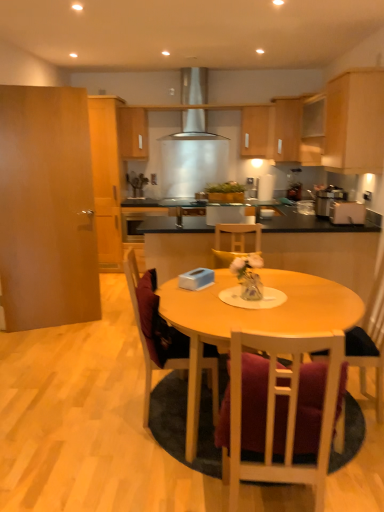
This screenshot has height=512, width=384. Identify the location of wooden cabinet at upper right, the 8th cabinetry in the left-to-right sequence. (312, 131).

How much space does wooden cabinet at upper right, placed as the 6th cabinetry when sorted from left to right, occupy vertically?

81.36 centimeters.

This screenshot has width=384, height=512. Describe the element at coordinates (326, 199) in the screenshot. I see `white glossy microwave at upper right, which is counted as the 2th appliance, starting from the front` at that location.

This screenshot has height=512, width=384. Find the location of `wooden chair at center, which is the 1th chair in left-to-right order`. wooden chair at center, which is the 1th chair in left-to-right order is located at coordinates (139, 326).

From a real-world perspective, is wooden chair at center, the 3th chair from the right, under wooden cabinet at upper center, the sixth cabinetry from the right?

Yes, from a real-world perspective, wooden chair at center, the 3th chair from the right, is below wooden cabinet at upper center, the sixth cabinetry from the right.

Considering the sizes of wooden chair at center, which is the 1th chair in left-to-right order, and wooden cabinet at upper center, the sixth cabinetry from the right, in the image, is wooden chair at center, which is the 1th chair in left-to-right order, bigger or smaller than wooden cabinet at upper center, the sixth cabinetry from the right,?

In the image, wooden chair at center, which is the 1th chair in left-to-right order, appears to be larger than wooden cabinet at upper center, the sixth cabinetry from the right.

Can you confirm if wooden chair at center, the 3th chair from the right, is taller than wooden cabinet at upper center, which ranks as the 3th cabinetry in left-to-right order?

Yes, wooden chair at center, the 3th chair from the right, is taller than wooden cabinet at upper center, which ranks as the 3th cabinetry in left-to-right order.

Is wooden chair at center, which is the 1th chair in left-to-right order, spatially inside wooden cabinet at upper center, which ranks as the 3th cabinetry in left-to-right order, or outside of it?

wooden chair at center, which is the 1th chair in left-to-right order, is not enclosed by wooden cabinet at upper center, which ranks as the 3th cabinetry in left-to-right order.

Is satin silver toaster at upper right, the second appliance viewed from the back, oriented towards wooden cabinet at upper right, placed as the 6th cabinetry when sorted from left to right?

No, satin silver toaster at upper right, the second appliance viewed from the back, is not oriented towards wooden cabinet at upper right, placed as the 6th cabinetry when sorted from left to right.

Is satin silver toaster at upper right, the first appliance when ordered from front to back, thinner than wooden cabinet at upper right, placed as the 6th cabinetry when sorted from left to right?

Yes.

Which object is positioned more to the left, satin silver toaster at upper right, the second appliance viewed from the back, or wooden cabinet at upper right, placed as the 6th cabinetry when sorted from left to right?

wooden cabinet at upper right, placed as the 6th cabinetry when sorted from left to right, is more to the left.

Who is smaller, satin silver toaster at upper right, the second appliance viewed from the back, or wooden cabinet at upper right, placed as the 6th cabinetry when sorted from left to right?

satin silver toaster at upper right, the second appliance viewed from the back.

Would you say white wooden chair at center, marked as the second chair in a left-to-right arrangement, is to the left or to the right of stainless steel exhaust hood at center in the picture?

Based on their positions, white wooden chair at center, marked as the second chair in a left-to-right arrangement, is located to the right of stainless steel exhaust hood at center.

Considering the points (271, 380) and (186, 117), which point is behind, point (271, 380) or point (186, 117)?

Positioned behind is point (186, 117).

Which of these two, white wooden chair at center, marked as the second chair in a right-to-left arrangement, or stainless steel exhaust hood at center, is wider?

Wider between the two is white wooden chair at center, marked as the second chair in a right-to-left arrangement.

Looking at this image, is white wooden chair at center, marked as the second chair in a right-to-left arrangement, completely or partially outside of stainless steel exhaust hood at center?

That's correct, white wooden chair at center, marked as the second chair in a right-to-left arrangement, is outside of stainless steel exhaust hood at center.

From the picture: Could you tell me if white glossy microwave at upper right, which is counted as the 2th appliance, starting from the front, is facing matte silver sink at center?

Yes, white glossy microwave at upper right, which is counted as the 2th appliance, starting from the front, is oriented towards matte silver sink at center.

Between white glossy microwave at upper right, which is counted as the 2th appliance, starting from the front, and matte silver sink at center, which one has larger width?

white glossy microwave at upper right, which is counted as the 2th appliance, starting from the front, is wider.

Is white glossy microwave at upper right, the 1th appliance positioned from the back, bigger or smaller than matte silver sink at center?

Clearly, white glossy microwave at upper right, the 1th appliance positioned from the back, is smaller in size than matte silver sink at center.

From a real-world perspective, is white glossy microwave at upper right, which is counted as the 2th appliance, starting from the front, over matte silver sink at center?

No, from a real-world perspective, white glossy microwave at upper right, which is counted as the 2th appliance, starting from the front, is not on top of matte silver sink at center.

Looking at this image, is wooden chair at right, the 3th chair viewed from the left, shorter than light wood cabinet at upper right, the seventh cabinetry positioned from the left?

No, wooden chair at right, the 3th chair viewed from the left, is not shorter than light wood cabinet at upper right, the seventh cabinetry positioned from the left.

Is point (355, 354) farther from camera compared to point (324, 165)?

That is False.

Is wooden chair at right, arranged as the first chair when viewed from the right, far from light wood cabinet at upper right, the seventh cabinetry positioned from the left?

Indeed, wooden chair at right, arranged as the first chair when viewed from the right, is not near light wood cabinet at upper right, the seventh cabinetry positioned from the left.

Considering the positions of objects wooden chair at right, the 3th chair viewed from the left, and light wood cabinet at upper right, positioned as the 2th cabinetry in right-to-left order, in the image provided, who is more to the right, wooden chair at right, the 3th chair viewed from the left, or light wood cabinet at upper right, positioned as the 2th cabinetry in right-to-left order,?

light wood cabinet at upper right, positioned as the 2th cabinetry in right-to-left order.

Do you think brown wood door at left, placed as the 8th cabinetry when sorted from right to left, is within matte silver sink at center, or outside of it?

brown wood door at left, placed as the 8th cabinetry when sorted from right to left, cannot be found inside matte silver sink at center.

Looking at this image, can you confirm if brown wood door at left, placed as the 8th cabinetry when sorted from right to left, is bigger than matte silver sink at center?

Yes, brown wood door at left, placed as the 8th cabinetry when sorted from right to left, is bigger than matte silver sink at center.

Is brown wood door at left, which is counted as the 1th cabinetry, starting from the left, in front of or behind matte silver sink at center in the image?

Visually, brown wood door at left, which is counted as the 1th cabinetry, starting from the left, is located in front of matte silver sink at center.

Can you confirm if brown wood door at left, which is counted as the 1th cabinetry, starting from the left, is shorter than matte silver sink at center?

No, brown wood door at left, which is counted as the 1th cabinetry, starting from the left, is not shorter than matte silver sink at center.

Considering the relative sizes of light wood cabinet at upper right, the seventh cabinetry positioned from the left, and wooden cabinet at upper right, placed as the 6th cabinetry when sorted from left to right, in the image provided, is light wood cabinet at upper right, the seventh cabinetry positioned from the left, bigger than wooden cabinet at upper right, placed as the 6th cabinetry when sorted from left to right,?

No.

Locate an element on the screen. Image resolution: width=384 pixels, height=512 pixels. cabinetry that is the 2nd object located below the wooden cabinet at upper right, which appears as the 3th cabinetry when viewed from the right (from the image's perspective) is located at coordinates (354, 122).

Is light wood cabinet at upper right, the seventh cabinetry positioned from the left, situated inside wooden cabinet at upper right, placed as the 6th cabinetry when sorted from left to right, or outside?

The correct answer is: outside.

Could you tell me if light wood cabinet at upper right, positioned as the 2th cabinetry in right-to-left order, is facing wooden cabinet at upper right, which appears as the 3th cabinetry when viewed from the right?

No, light wood cabinet at upper right, positioned as the 2th cabinetry in right-to-left order, is not oriented towards wooden cabinet at upper right, which appears as the 3th cabinetry when viewed from the right.

From a real-world perspective, which cabinetry is the 7th one above the wooden chair at center, the 3th chair from the right? Please provide its 2D coordinates.

[(133, 133)]

Find the location of `appliance lying on the right of wooden cabinet at upper right, which appears as the 3th cabinetry when viewed from the right`. appliance lying on the right of wooden cabinet at upper right, which appears as the 3th cabinetry when viewed from the right is located at coordinates (347, 213).

Considering their positions, is wooden chair at center, which is the 1th chair in left-to-right order, positioned closer to white glossy microwave at upper right, the 1th appliance positioned from the back, than wooden cabinet at upper right, positioned as the first cabinetry in right-to-left order?

wooden cabinet at upper right, positioned as the first cabinetry in right-to-left order, is closer to white glossy microwave at upper right, the 1th appliance positioned from the back.

Which object lies nearer to the anchor point wooden chair at right, arranged as the first chair when viewed from the right, wooden cabinet at upper right, the 8th cabinetry in the left-to-right sequence, or matte wood cabinet at upper center, placed as the fifth cabinetry when sorted from left to right?

Among the two, wooden cabinet at upper right, the 8th cabinetry in the left-to-right sequence, is located nearer to wooden chair at right, arranged as the first chair when viewed from the right.

Which object lies further to the anchor point matte silver sink at center, wooden chair at center, the 3th chair from the right, or wooden cabinet at upper center, which ranks as the 3th cabinetry in left-to-right order?

Based on the image, wooden chair at center, the 3th chair from the right, appears to be further to matte silver sink at center.

Looking at this image, from the image, which object appears to be nearer to wooden cabinet at upper center, which ranks as the 3th cabinetry in left-to-right order, wooden cabinet at upper right, the 8th cabinetry in the left-to-right sequence, or white glossy microwave at upper right, which is counted as the 2th appliance, starting from the front?

The object closer to wooden cabinet at upper center, which ranks as the 3th cabinetry in left-to-right order, is wooden cabinet at upper right, the 8th cabinetry in the left-to-right sequence.

Which object lies nearer to the anchor point satin silver toaster at upper right, the second appliance viewed from the back, white wooden chair at center, marked as the second chair in a left-to-right arrangement, or matte wood cabinet at upper center, which is counted as the 4th cabinetry, starting from the right?

Among the two, white wooden chair at center, marked as the second chair in a left-to-right arrangement, is located nearer to satin silver toaster at upper right, the second appliance viewed from the back.

Based on their spatial positions, is white wooden chair at center, marked as the second chair in a left-to-right arrangement, or white glossy microwave at upper right, which is counted as the 2th appliance, starting from the front, closer to light wood table at center?

Based on the image, white wooden chair at center, marked as the second chair in a left-to-right arrangement, appears to be nearer to light wood table at center.

Which object lies further to the anchor point wooden chair at right, arranged as the first chair when viewed from the right, wooden cabinet at upper center, the fifth cabinetry when ordered from right to left, or wooden cabinet at upper right, which appears as the 3th cabinetry when viewed from the right?

The object further to wooden chair at right, arranged as the first chair when viewed from the right, is wooden cabinet at upper center, the fifth cabinetry when ordered from right to left.

Looking at the image, which one is located closer to wooden cabinet at upper right, which appears as the 3th cabinetry when viewed from the right, light wood table at center or light brown wood cabinet at left, the 7th cabinetry when ordered from right to left?

light brown wood cabinet at left, the 7th cabinetry when ordered from right to left, is positioned closer to the anchor wooden cabinet at upper right, which appears as the 3th cabinetry when viewed from the right.

This screenshot has width=384, height=512. Identify the location of appliance between stainless steel exhaust hood at center and wooden cabinet at upper right, placed as the 6th cabinetry when sorted from left to right, from left to right. (326, 199).

Where is `exhaust hood positioned between light wood table at center and wooden cabinet at upper center, the fifth cabinetry when ordered from right to left, from near to far`? This screenshot has height=512, width=384. exhaust hood positioned between light wood table at center and wooden cabinet at upper center, the fifth cabinetry when ordered from right to left, from near to far is located at coordinates (194, 127).

This screenshot has height=512, width=384. I want to click on exhaust hood situated between wooden cabinet at upper center, the sixth cabinetry from the right, and satin silver toaster at upper right, the first appliance when ordered from front to back, from left to right, so click(x=194, y=127).

The width and height of the screenshot is (384, 512). I want to click on exhaust hood situated between wooden cabinet at upper center, which ranks as the 3th cabinetry in left-to-right order, and wooden cabinet at upper center, the fifth cabinetry when ordered from right to left, from left to right, so click(194, 127).